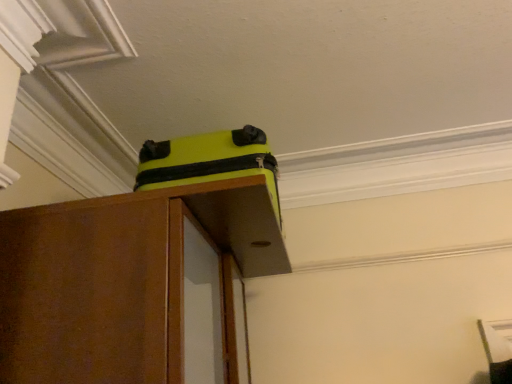
Identify the location of matte yellow suitcase at upper center. This screenshot has height=384, width=512. (209, 161).

Measure the distance between matte yellow suitcase at upper center and camera.

A distance of 35.43 inches exists between matte yellow suitcase at upper center and camera.

Describe the element at coordinates (209, 161) in the screenshot. I see `matte yellow suitcase at upper center` at that location.

What are the coordinates of `matte yellow suitcase at upper center` in the screenshot? It's located at (209, 161).